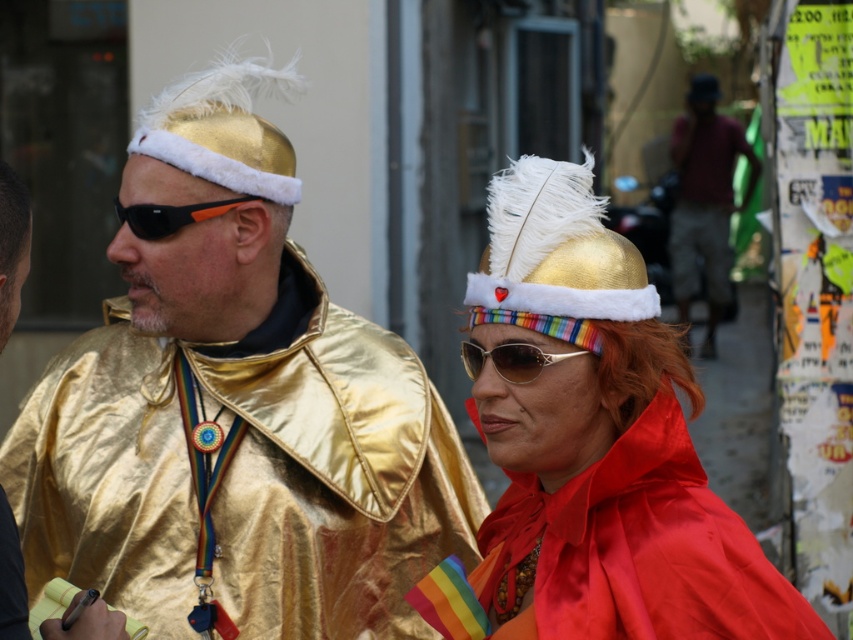
Does point (262, 336) come closer to viewer compared to point (781, 625)?

No.

Describe the element at coordinates (236, 410) in the screenshot. I see `metallic gold cape at left` at that location.

The width and height of the screenshot is (853, 640). I want to click on metallic gold cape at left, so click(236, 410).

This screenshot has height=640, width=853. Describe the element at coordinates (595, 445) in the screenshot. I see `shiny gold headdress at center` at that location.

Does point (566, 442) come farther from viewer compared to point (158, 208)?

No.

Where is `shiny gold headdress at center`? Image resolution: width=853 pixels, height=640 pixels. shiny gold headdress at center is located at coordinates (x=595, y=445).

Does shiny gold headdress at center appear on the left side of metallic gold cape at center?

In fact, shiny gold headdress at center is to the right of metallic gold cape at center.

Between shiny gold headdress at center and metallic gold cape at center, which one appears on the left side from the viewer's perspective?

Positioned to the left is metallic gold cape at center.

Is point (664, 349) in front of point (28, 218)?

No, it is behind (28, 218).

Identify the location of shiny gold headdress at center. (595, 445).